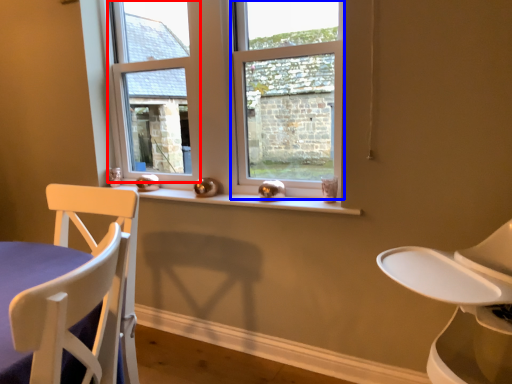
Question: Which object is further to the camera taking this photo, window frame (highlighted by a red box) or window (highlighted by a blue box)?

Choices:
 (A) window frame
 (B) window

Answer: (A)